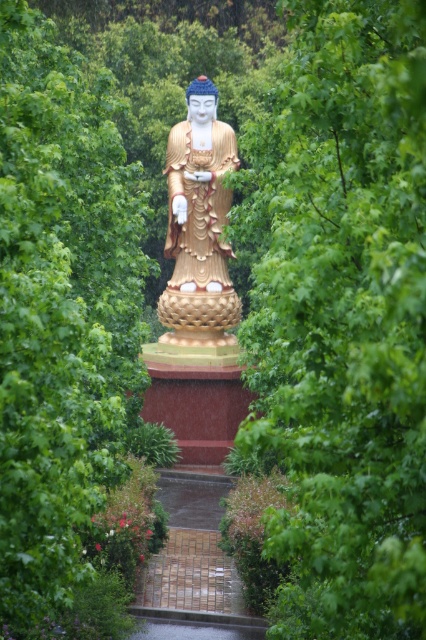
Question: Does green leafy bush at center have a larger size compared to gold polished statue at center?

Choices:
 (A) yes
 (B) no

Answer: (A)

Question: Among these objects, which one is farthest from the camera?

Choices:
 (A) green leafy bush at center
 (B) green leafy tree at center

Answer: (A)

Question: Estimate the real-world distances between objects in this image. Which object is farther from the green leafy bush at center?

Choices:
 (A) green leafy tree at center
 (B) gold polished statue at center

Answer: (B)

Question: Is green leafy tree at center below gold polished statue at center?

Choices:
 (A) no
 (B) yes

Answer: (B)

Question: Which object appears farthest from the camera in this image?

Choices:
 (A) green leafy tree at center
 (B) gold polished statue at center

Answer: (B)

Question: Is green leafy tree at center wider than gold polished statue at center?

Choices:
 (A) no
 (B) yes

Answer: (A)